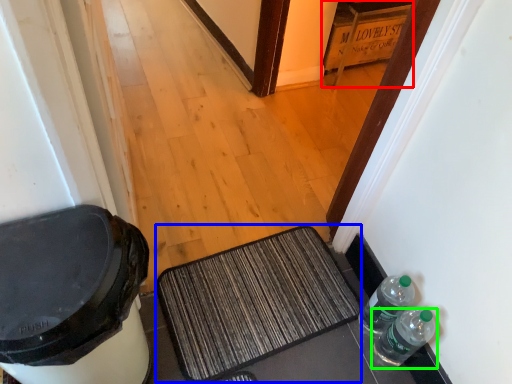
Question: Considering the real-world distances, which object is closest to cabinetry (highlighted by a red box)? doormat (highlighted by a blue box) or bottle (highlighted by a green box).

Choices:
 (A) doormat
 (B) bottle

Answer: (A)